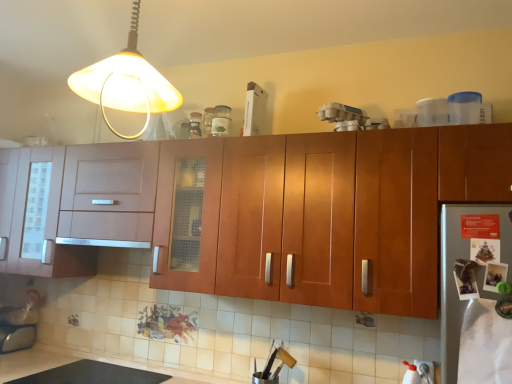
What is the approximate width of wooden cabinet at upper center?

wooden cabinet at upper center is 35.98 centimeters wide.

The height and width of the screenshot is (384, 512). Describe the element at coordinates (126, 83) in the screenshot. I see `matte yellow plastic lampshade at upper left` at that location.

How much space does clear glass jar at upper center, acting as the 2th bottle starting from the left, occupy horizontally?

It is 3.26 inches.

In order to click on wooden cabinet at upper center in this screenshot , I will do `click(350, 212)`.

From a real-world perspective, which bottle is the 2nd one above the wooden cabinet at upper center? Please provide its 2D coordinates.

[(195, 125)]

Between matte glass bottle at upper center, which is the first bottle in left-to-right order, and wooden cabinet at upper center, which one is positioned in front?

wooden cabinet at upper center is closer to the camera.

Does matte glass bottle at upper center, which is the first bottle in left-to-right order, have a smaller size compared to wooden cabinet at upper center?

Yes, matte glass bottle at upper center, which is the first bottle in left-to-right order, is smaller than wooden cabinet at upper center.

Is matte yellow plastic lampshade at upper left oriented away from satin silver exhaust hood at center?

No.

Is matte yellow plastic lampshade at upper left surrounding satin silver exhaust hood at center?

That's incorrect, satin silver exhaust hood at center is not inside matte yellow plastic lampshade at upper left.

From a real-world perspective, is matte yellow plastic lampshade at upper left on satin silver exhaust hood at center?

Yes, from a real-world perspective, matte yellow plastic lampshade at upper left is over satin silver exhaust hood at center

Considering the sizes of matte yellow plastic lampshade at upper left and satin silver exhaust hood at center in the image, is matte yellow plastic lampshade at upper left bigger or smaller than satin silver exhaust hood at center?

Clearly, matte yellow plastic lampshade at upper left is larger in size than satin silver exhaust hood at center.

Considering the relative sizes of wooden cabinet at upper center and matte yellow plastic lampshade at upper left in the image provided, is wooden cabinet at upper center bigger than matte yellow plastic lampshade at upper left?

Yes.

Does point (475, 192) come in front of point (145, 87)?

That is False.

Locate an element on the screen. lamp above the wooden cabinet at upper center (from the image's perspective) is located at coordinates (126, 83).

Is satin silver exhaust hood at center wider than matte glass bottle at upper center, which is the first bottle in left-to-right order?

Correct, the width of satin silver exhaust hood at center exceeds that of matte glass bottle at upper center, which is the first bottle in left-to-right order.

Which is further, (84, 244) or (198, 126)?

The point (84, 244) is farther from the camera.

From the image's perspective, which bottle is the 2nd one above the satin silver exhaust hood at center? Please provide its 2D coordinates.

[(195, 125)]

Which of these two, satin silver exhaust hood at center or matte glass bottle at upper center, which is the first bottle in left-to-right order, stands taller?

matte glass bottle at upper center, which is the first bottle in left-to-right order.

Considering the relative sizes of matte glass bottle at upper center, acting as the 2th bottle starting from the right, and clear glass jar at upper center, which ranks as the 1th bottle in right-to-left order, in the image provided, is matte glass bottle at upper center, acting as the 2th bottle starting from the right, wider than clear glass jar at upper center, which ranks as the 1th bottle in right-to-left order,?

Correct, the width of matte glass bottle at upper center, acting as the 2th bottle starting from the right, exceeds that of clear glass jar at upper center, which ranks as the 1th bottle in right-to-left order.

Can you see matte glass bottle at upper center, which is the first bottle in left-to-right order, touching clear glass jar at upper center, acting as the 2th bottle starting from the left?

matte glass bottle at upper center, which is the first bottle in left-to-right order, is not next to clear glass jar at upper center, acting as the 2th bottle starting from the left, and they're not touching.

Could clear glass jar at upper center, which ranks as the 1th bottle in right-to-left order, be considered to be inside matte glass bottle at upper center, which is the first bottle in left-to-right order?

No, clear glass jar at upper center, which ranks as the 1th bottle in right-to-left order, is not a part of matte glass bottle at upper center, which is the first bottle in left-to-right order.

Is matte glass bottle at upper center, which is the first bottle in left-to-right order, turned away from matte yellow plastic lampshade at upper left?

That's not correct — matte glass bottle at upper center, which is the first bottle in left-to-right order, is not looking away from matte yellow plastic lampshade at upper left.

Which is behind, point (198, 124) or point (167, 109)?

The point (198, 124) is farther.

Find the location of a particular element. lamp in front of the matte glass bottle at upper center, which is the first bottle in left-to-right order is located at coordinates (126, 83).

Looking at this image, which object is more forward, matte glass bottle at upper center, which is the first bottle in left-to-right order, or matte yellow plastic lampshade at upper left?

matte yellow plastic lampshade at upper left is more forward.

Where is `lamp that appears on the left of clear glass jar at upper center, which ranks as the 1th bottle in right-to-left order`? This screenshot has width=512, height=384. lamp that appears on the left of clear glass jar at upper center, which ranks as the 1th bottle in right-to-left order is located at coordinates (126, 83).

Are matte yellow plastic lampshade at upper left and clear glass jar at upper center, which ranks as the 1th bottle in right-to-left order, making contact?

No.

Could you tell me if matte yellow plastic lampshade at upper left is facing clear glass jar at upper center, acting as the 2th bottle starting from the left?

No, matte yellow plastic lampshade at upper left does not turn towards clear glass jar at upper center, acting as the 2th bottle starting from the left.

In the image, there is a matte glass bottle at upper center, acting as the 2th bottle starting from the right. In order to click on cabinetry below it (from the image's perspective) in this screenshot , I will do `click(350, 212)`.

You are a GUI agent. You are given a task and a screenshot of the screen. Output one action in this format:
    pyautogui.click(x=<x>, y=<y>)
    Task: Click on the exhaust hood on the left of matte yellow plastic lampshade at upper left
    The image size is (512, 384).
    Given the screenshot: What is the action you would take?
    pyautogui.click(x=103, y=242)

From the image, which object appears to be farther from satin silver exhaust hood at center, matte glass bottle at upper center, acting as the 2th bottle starting from the right, or clear glass jar at upper center, which ranks as the 1th bottle in right-to-left order?

clear glass jar at upper center, which ranks as the 1th bottle in right-to-left order, lies further to satin silver exhaust hood at center than the other object.

Considering their positions, is satin silver exhaust hood at center positioned closer to matte yellow plastic lampshade at upper left than wooden cabinet at upper center?

wooden cabinet at upper center.

Looking at the image, which one is located further to wooden cabinet at upper center, matte yellow plastic lampshade at upper left or matte glass bottle at upper center, which is the first bottle in left-to-right order?

Among the two, matte yellow plastic lampshade at upper left is located further to wooden cabinet at upper center.

Looking at the image, which one is located further to wooden cabinet at upper center, matte glass bottle at upper center, which is the first bottle in left-to-right order, or satin silver exhaust hood at center?

satin silver exhaust hood at center is further to wooden cabinet at upper center.

From the image, which object appears to be farther from wooden cabinet at upper center, satin silver exhaust hood at center or clear glass jar at upper center, which ranks as the 1th bottle in right-to-left order?

Based on the image, satin silver exhaust hood at center appears to be further to wooden cabinet at upper center.

Which object lies nearer to the anchor point wooden cabinet at upper center, clear glass jar at upper center, which ranks as the 1th bottle in right-to-left order, or satin silver exhaust hood at center?

Among the two, clear glass jar at upper center, which ranks as the 1th bottle in right-to-left order, is located nearer to wooden cabinet at upper center.

From the image, which object appears to be farther from wooden cabinet at upper center, satin silver exhaust hood at center or matte glass bottle at upper center, acting as the 2th bottle starting from the right?

satin silver exhaust hood at center lies further to wooden cabinet at upper center than the other object.

From the picture: Estimate the real-world distances between objects in this image. Which object is closer to wooden cabinet at upper center, matte yellow plastic lampshade at upper left or clear glass jar at upper center, acting as the 2th bottle starting from the left?

clear glass jar at upper center, acting as the 2th bottle starting from the left, is positioned closer to the anchor wooden cabinet at upper center.

Locate an element on the screen. This screenshot has width=512, height=384. exhaust hood positioned between wooden cabinet at upper center and clear glass jar at upper center, acting as the 2th bottle starting from the left, from near to far is located at coordinates (103, 242).

What are the coordinates of `cabinetry between matte yellow plastic lampshade at upper left and satin silver exhaust hood at center from front to back` in the screenshot? It's located at pyautogui.click(x=350, y=212).

The image size is (512, 384). I want to click on exhaust hood between wooden cabinet at upper center and matte glass bottle at upper center, which is the first bottle in left-to-right order, along the z-axis, so click(103, 242).

Where is `bottle located between wooden cabinet at upper center and matte glass bottle at upper center, acting as the 2th bottle starting from the right, in the depth direction`? The height and width of the screenshot is (384, 512). bottle located between wooden cabinet at upper center and matte glass bottle at upper center, acting as the 2th bottle starting from the right, in the depth direction is located at coordinates (221, 121).